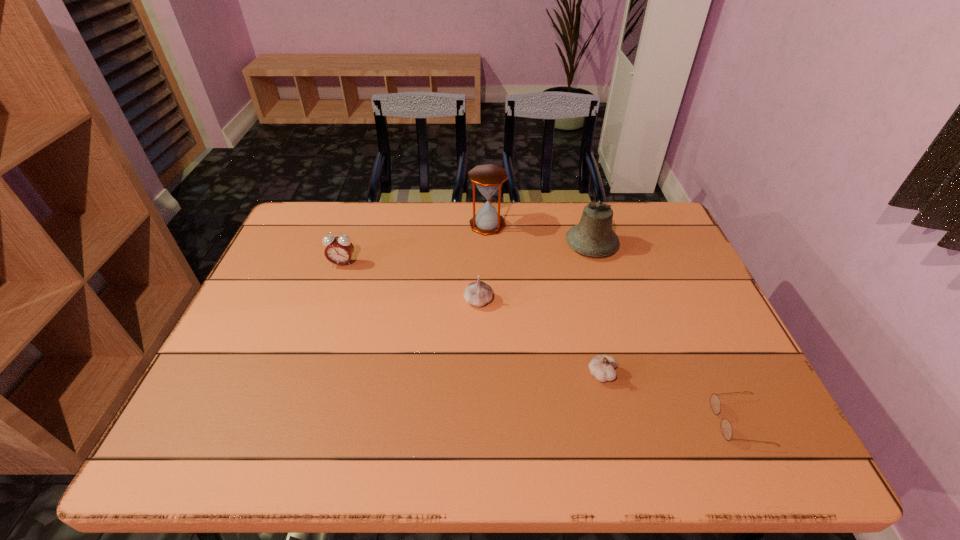
Identify the location of vacant area that lies between the alarm clock and the left garlic. The width and height of the screenshot is (960, 540). (410, 282).

What are the coordinates of `unoccupied area between the bell and the nearest object` in the screenshot? It's located at (665, 333).

This screenshot has height=540, width=960. Identify the location of free space between the alarm clock and the nearer garlic. (472, 319).

Image resolution: width=960 pixels, height=540 pixels. What are the coordinates of `vacant space that is in between the nearer garlic and the second tallest object` in the screenshot? It's located at (597, 309).

Find the location of a particular element. free area in between the farther garlic and the nearer garlic is located at coordinates (540, 338).

In order to click on vacant space in between the fourth shortest object and the bell in this screenshot , I will do `click(467, 254)`.

Locate an element on the screen. blank region between the nearest object and the alarm clock is located at coordinates (540, 343).

Locate an element on the screen. blank region between the hourglass and the leftmost object is located at coordinates (415, 244).

At what (x,y) coordinates should I click in order to perform the action: click on free area in between the nearer garlic and the leftmost object. Please return your answer as a coordinate pair (x, y). Looking at the image, I should click on (472, 319).

Locate an element on the screen. The image size is (960, 540). object identified as the third closest to the farther garlic is located at coordinates (601, 367).